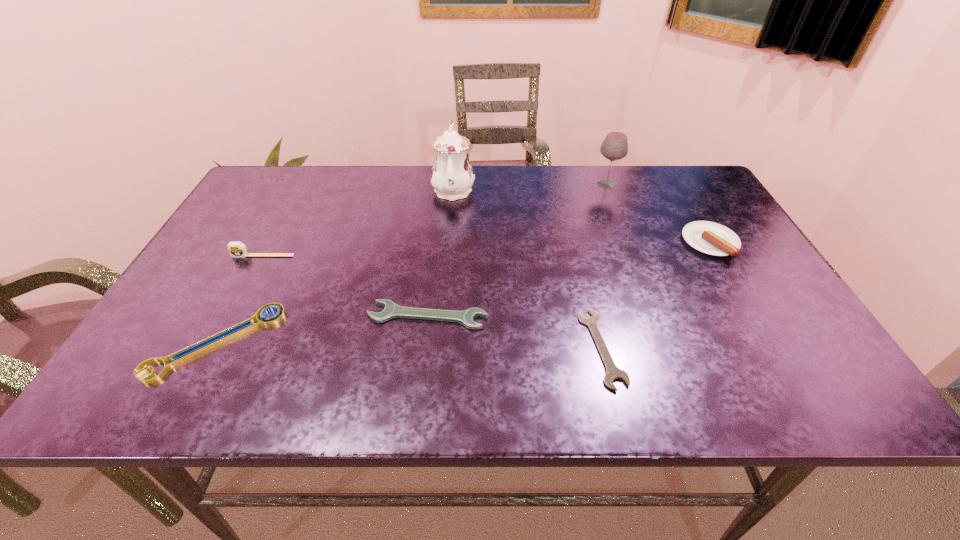
Image resolution: width=960 pixels, height=540 pixels. Identify the location of free space that satisfies the following two spatial constraints: 1. on the back side of the second wrench from left to right; 2. on the right side of the leftmost wrench. (230, 316).